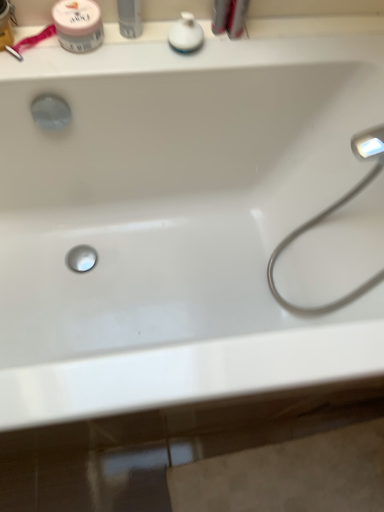
This screenshot has height=512, width=384. What do you see at coordinates (331, 213) in the screenshot? I see `satin nickel faucet at right` at bounding box center [331, 213].

In order to face white glossy soap dispenser at upper center, which is counted as the first toiletry, starting from the right, should I rotate leftwards or rightwards?

It's best to rotate left around 1.006 degrees.

Describe the element at coordinates (130, 18) in the screenshot. This screenshot has height=512, width=384. I see `white glossy spray can at upper center, which is the 1th toiletry in left-to-right order` at that location.

The height and width of the screenshot is (512, 384). What are the coordinates of `satin nickel faucet at right` in the screenshot? It's located at (x=331, y=213).

Based on the photo, can you tell me how much white glossy spray can at upper center, which is the second toiletry from right to left, and pink matte jar at upper left differ in facing direction?

white glossy spray can at upper center, which is the second toiletry from right to left, and pink matte jar at upper left are facing 0.00132 degrees away from each other.

Considering the relative sizes of white glossy spray can at upper center, which is the second toiletry from right to left, and pink matte jar at upper left in the image provided, is white glossy spray can at upper center, which is the second toiletry from right to left, taller than pink matte jar at upper left?

Yes.

Is white glossy spray can at upper center, which is the 1th toiletry in left-to-right order, smaller than pink matte jar at upper left?

Correct, white glossy spray can at upper center, which is the 1th toiletry in left-to-right order, occupies less space than pink matte jar at upper left.

Is white glossy spray can at upper center, which is the 1th toiletry in left-to-right order, positioned before pink matte jar at upper left?

Yes, it is in front of pink matte jar at upper left.

Between pink matte jar at upper left and white glossy soap dispenser at upper center, which is counted as the 2th toiletry, starting from the left, which one has smaller size?

Smaller between the two is white glossy soap dispenser at upper center, which is counted as the 2th toiletry, starting from the left.

How much distance is there between pink matte jar at upper left and white glossy soap dispenser at upper center, which is counted as the 2th toiletry, starting from the left?

A distance of 7.45 inches exists between pink matte jar at upper left and white glossy soap dispenser at upper center, which is counted as the 2th toiletry, starting from the left.

Is pink matte jar at upper left taller or shorter than white glossy soap dispenser at upper center, which is counted as the 2th toiletry, starting from the left?

pink matte jar at upper left is taller than white glossy soap dispenser at upper center, which is counted as the 2th toiletry, starting from the left.

Does pink matte jar at upper left have a lesser width compared to white glossy soap dispenser at upper center, which is counted as the first toiletry, starting from the right?

No, pink matte jar at upper left is not thinner than white glossy soap dispenser at upper center, which is counted as the first toiletry, starting from the right.

Can you confirm if satin nickel faucet at right is thinner than white glossy spray can at upper center, which is the 1th toiletry in left-to-right order?

No.

What's the angular difference between satin nickel faucet at right and white glossy spray can at upper center, which is the second toiletry from right to left,'s facing directions?

91.6 degrees.

Is satin nickel faucet at right at the right side of white glossy spray can at upper center, which is the second toiletry from right to left?

Correct, you'll find satin nickel faucet at right to the right of white glossy spray can at upper center, which is the second toiletry from right to left.

Looking at this image, does satin nickel faucet at right have a greater height compared to white glossy spray can at upper center, which is the second toiletry from right to left?

Correct, satin nickel faucet at right is much taller as white glossy spray can at upper center, which is the second toiletry from right to left.

Looking at this image, is white glossy soap dispenser at upper center, which is counted as the 2th toiletry, starting from the left, aimed at white glossy spray can at upper center, which is the second toiletry from right to left?

No, white glossy soap dispenser at upper center, which is counted as the 2th toiletry, starting from the left, is not facing towards white glossy spray can at upper center, which is the second toiletry from right to left.

At what (x,y) coordinates should I click in order to perform the action: click on toiletry positioned vertically above the white glossy soap dispenser at upper center, which is counted as the 2th toiletry, starting from the left (from a real-world perspective). Please return your answer as a coordinate pair (x, y). This screenshot has height=512, width=384. Looking at the image, I should click on (130, 18).

Considering the points (177, 40) and (136, 36), which point is behind, point (177, 40) or point (136, 36)?

The point (136, 36) is farther.

Can you see white glossy soap dispenser at upper center, which is counted as the first toiletry, starting from the right, touching white glossy spray can at upper center, which is the 1th toiletry in left-to-right order?

No.

Does point (141, 24) come farther from viewer compared to point (182, 22)?

Yes, it is.

Can you confirm if white glossy spray can at upper center, which is the 1th toiletry in left-to-right order, is smaller than white glossy soap dispenser at upper center, which is counted as the 2th toiletry, starting from the left?

Incorrect, white glossy spray can at upper center, which is the 1th toiletry in left-to-right order, is not smaller in size than white glossy soap dispenser at upper center, which is counted as the 2th toiletry, starting from the left.

Is white glossy spray can at upper center, which is the second toiletry from right to left, taller than white glossy soap dispenser at upper center, which is counted as the 2th toiletry, starting from the left?

Yes, white glossy spray can at upper center, which is the second toiletry from right to left, is taller than white glossy soap dispenser at upper center, which is counted as the 2th toiletry, starting from the left.

Is white glossy spray can at upper center, which is the 1th toiletry in left-to-right order, wider than white glossy soap dispenser at upper center, which is counted as the 2th toiletry, starting from the left?

In fact, white glossy spray can at upper center, which is the 1th toiletry in left-to-right order, might be narrower than white glossy soap dispenser at upper center, which is counted as the 2th toiletry, starting from the left.

How different are the orientations of white glossy soap dispenser at upper center, which is counted as the first toiletry, starting from the right, and satin nickel faucet at right in degrees?

They differ by 91.6 degrees in their facing directions.

Is white glossy soap dispenser at upper center, which is counted as the 2th toiletry, starting from the left, taller or shorter than satin nickel faucet at right?

white glossy soap dispenser at upper center, which is counted as the 2th toiletry, starting from the left, is shorter than satin nickel faucet at right.

Is white glossy soap dispenser at upper center, which is counted as the 2th toiletry, starting from the left, touching satin nickel faucet at right?

white glossy soap dispenser at upper center, which is counted as the 2th toiletry, starting from the left, and satin nickel faucet at right are not in contact.

Considering the points (198, 30) and (301, 227), which point is behind, point (198, 30) or point (301, 227)?

The point (301, 227) is behind.

Does white glossy spray can at upper center, which is the 1th toiletry in left-to-right order, have a lesser width compared to satin nickel faucet at right?

Yes, white glossy spray can at upper center, which is the 1th toiletry in left-to-right order, is thinner than satin nickel faucet at right.

Which is in front, point (132, 20) or point (314, 310)?

The point (132, 20) is in front.

Can you confirm if white glossy spray can at upper center, which is the second toiletry from right to left, is positioned to the right of satin nickel faucet at right?

In fact, white glossy spray can at upper center, which is the second toiletry from right to left, is to the left of satin nickel faucet at right.

Locate an element on the screen. the 1st toiletry to the right of the pink matte jar at upper left, counting from the anchor's position is located at coordinates (130, 18).

This screenshot has width=384, height=512. What are the coordinates of `mouthwash to the left of white glossy soap dispenser at upper center, which is counted as the first toiletry, starting from the right` in the screenshot? It's located at (78, 25).

Considering their positions, is satin nickel faucet at right positioned closer to white glossy soap dispenser at upper center, which is counted as the 2th toiletry, starting from the left, than pink matte jar at upper left?

Among the two, pink matte jar at upper left is located nearer to white glossy soap dispenser at upper center, which is counted as the 2th toiletry, starting from the left.

Looking at the image, which one is located closer to white glossy soap dispenser at upper center, which is counted as the first toiletry, starting from the right, pink matte jar at upper left or satin nickel faucet at right?

pink matte jar at upper left.

Based on their spatial positions, is white glossy spray can at upper center, which is the 1th toiletry in left-to-right order, or satin nickel faucet at right further from white glossy soap dispenser at upper center, which is counted as the 2th toiletry, starting from the left?

Among the two, satin nickel faucet at right is located further to white glossy soap dispenser at upper center, which is counted as the 2th toiletry, starting from the left.

Looking at the image, which one is located further to white glossy spray can at upper center, which is the second toiletry from right to left, satin nickel faucet at right or white glossy soap dispenser at upper center, which is counted as the first toiletry, starting from the right?

satin nickel faucet at right.

Based on their spatial positions, is white glossy soap dispenser at upper center, which is counted as the 2th toiletry, starting from the left, or white glossy spray can at upper center, which is the second toiletry from right to left, further from satin nickel faucet at right?

white glossy spray can at upper center, which is the second toiletry from right to left, is positioned further to the anchor satin nickel faucet at right.

Based on their spatial positions, is white glossy soap dispenser at upper center, which is counted as the 2th toiletry, starting from the left, or satin nickel faucet at right further from white glossy spray can at upper center, which is the second toiletry from right to left?

satin nickel faucet at right.

Estimate the real-world distances between objects in this image. Which object is further from pink matte jar at upper left, satin nickel faucet at right or white glossy soap dispenser at upper center, which is counted as the 2th toiletry, starting from the left?

Based on the image, satin nickel faucet at right appears to be further to pink matte jar at upper left.

Estimate the real-world distances between objects in this image. Which object is further from satin nickel faucet at right, white glossy soap dispenser at upper center, which is counted as the 2th toiletry, starting from the left, or pink matte jar at upper left?

pink matte jar at upper left.

You are a GUI agent. You are given a task and a screenshot of the screen. Output one action in this format:
    pyautogui.click(x=<x>, y=<y>)
    Task: Click on the toiletry situated between pink matte jar at upper left and white glossy soap dispenser at upper center, which is counted as the first toiletry, starting from the right, from left to right
    Image resolution: width=384 pixels, height=512 pixels.
    Given the screenshot: What is the action you would take?
    pyautogui.click(x=130, y=18)

The image size is (384, 512). Identify the location of toiletry located between white glossy spray can at upper center, which is the second toiletry from right to left, and satin nickel faucet at right in the left-right direction. (186, 34).